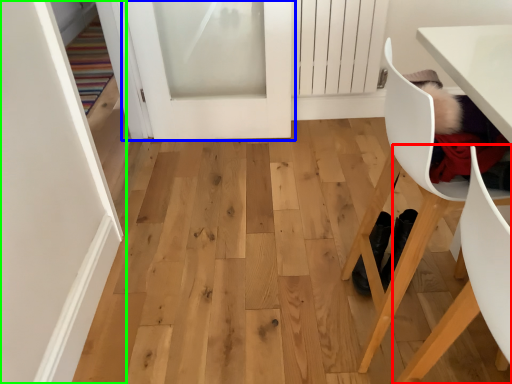
Question: Which object is positioned closest to chair (highlighted by a red box)? Select from door (highlighted by a blue box) and door (highlighted by a green box).

Choices:
 (A) door
 (B) door

Answer: (B)